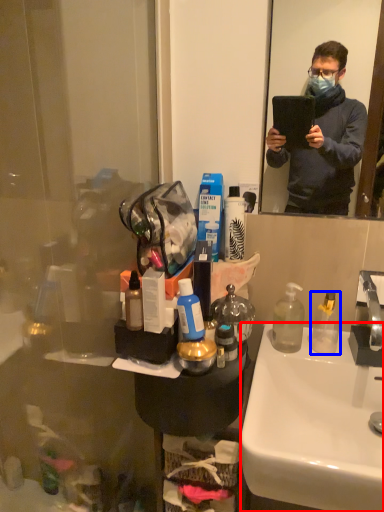
Question: Which of the following is the closest to the observer, sink (highlighted by a red box) or bottle (highlighted by a blue box)?

Choices:
 (A) sink
 (B) bottle

Answer: (A)